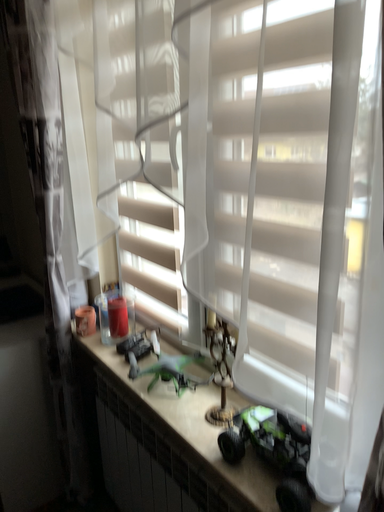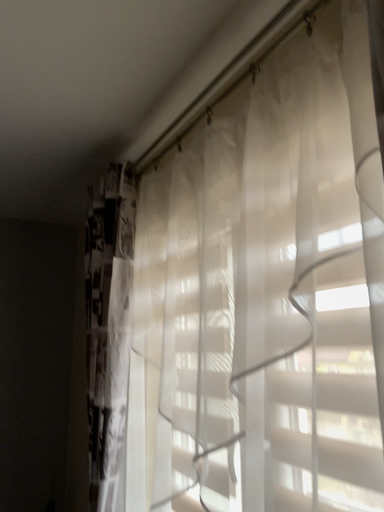
Question: How did the camera likely rotate when shooting the video?

Choices:
 (A) rotated right
 (B) rotated left

Answer: (B)